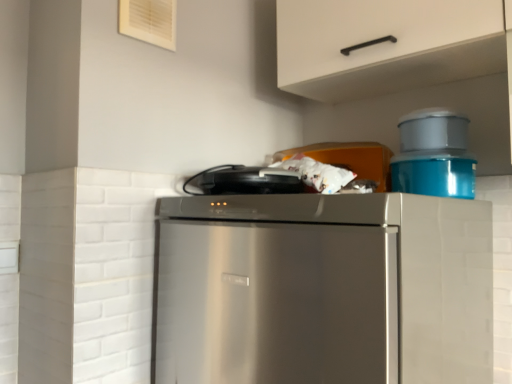
Locate an element on the screen. black matte toaster at upper center, the 3th appliance when ordered from right to left is located at coordinates (245, 181).

Based on the photo, measure the distance between point (457, 161) and camera.

The distance of point (457, 161) from camera is 1.02 meters.

Locate an element on the screen. The width and height of the screenshot is (512, 384). matte plastic container at upper right, placed as the 2th appliance when sorted from left to right is located at coordinates pyautogui.click(x=433, y=130).

At what (x,y) coordinates should I click in order to perform the action: click on black matte toaster at upper center, acting as the first appliance starting from the left. Please return your answer as a coordinate pair (x, y). This screenshot has width=512, height=384. Looking at the image, I should click on (245, 181).

Can you tell me how much blue plastic container at upper right, the third appliance from the left, and black matte toaster at upper center, acting as the first appliance starting from the left, differ in facing direction?

There is a 4.19e-05-degree angle between the facing directions of blue plastic container at upper right, the third appliance from the left, and black matte toaster at upper center, acting as the first appliance starting from the left.

At what (x,y) coordinates should I click in order to perform the action: click on the 2nd appliance behind the black matte toaster at upper center, the 3th appliance when ordered from right to left, starting your count from the anchor. Please return your answer as a coordinate pair (x, y). The image size is (512, 384). Looking at the image, I should click on (435, 177).

Between point (440, 186) and point (256, 167), which one is positioned behind?

Positioned behind is point (256, 167).

In the image, is blue plastic container at upper right, the third appliance from the left, positioned in front of or behind black matte toaster at upper center, the 3th appliance when ordered from right to left?

Clearly, blue plastic container at upper right, the third appliance from the left, is behind black matte toaster at upper center, the 3th appliance when ordered from right to left.

Measure the distance between stainless steel refrigerator at center and white matte cabinet handle at upper center.

stainless steel refrigerator at center is 21.94 inches away from white matte cabinet handle at upper center.

Would you say stainless steel refrigerator at center is to the left or to the right of white matte cabinet handle at upper center in the picture?

In the image, stainless steel refrigerator at center appears on the left side of white matte cabinet handle at upper center.

Is stainless steel refrigerator at center aimed at white matte cabinet handle at upper center?

No, stainless steel refrigerator at center is not facing towards white matte cabinet handle at upper center.

In terms of height, does stainless steel refrigerator at center look taller or shorter compared to white matte cabinet handle at upper center?

stainless steel refrigerator at center is taller than white matte cabinet handle at upper center.

Is blue plastic container at upper right, the third appliance from the left, wider than stainless steel refrigerator at center?

In fact, blue plastic container at upper right, the third appliance from the left, might be narrower than stainless steel refrigerator at center.

Is blue plastic container at upper right, the first appliance from the right, closer to camera compared to stainless steel refrigerator at center?

That is False.

From a real-world perspective, is blue plastic container at upper right, the first appliance from the right, located beneath stainless steel refrigerator at center?

No, from a real-world perspective, blue plastic container at upper right, the first appliance from the right, is not under stainless steel refrigerator at center.

Is matte plastic container at upper right, which appears as the second appliance when viewed from the right, touching white matte cabinet handle at upper center?

No, matte plastic container at upper right, which appears as the second appliance when viewed from the right, is not beside white matte cabinet handle at upper center.

From the image's perspective, is matte plastic container at upper right, which appears as the second appliance when viewed from the right, over white matte cabinet handle at upper center?

Incorrect, from the image's perspective, matte plastic container at upper right, which appears as the second appliance when viewed from the right, is lower than white matte cabinet handle at upper center.

Considering the relative sizes of matte plastic container at upper right, which appears as the second appliance when viewed from the right, and white matte cabinet handle at upper center in the image provided, is matte plastic container at upper right, which appears as the second appliance when viewed from the right, wider than white matte cabinet handle at upper center?

In fact, matte plastic container at upper right, which appears as the second appliance when viewed from the right, might be narrower than white matte cabinet handle at upper center.

Can you see stainless steel refrigerator at center touching matte plastic container at upper right, which appears as the second appliance when viewed from the right?

No, stainless steel refrigerator at center is not next to matte plastic container at upper right, which appears as the second appliance when viewed from the right.

Between stainless steel refrigerator at center and matte plastic container at upper right, which appears as the second appliance when viewed from the right, which one has more height?

stainless steel refrigerator at center.

Can you confirm if stainless steel refrigerator at center is positioned to the left of matte plastic container at upper right, placed as the 2th appliance when sorted from left to right?

Correct, you'll find stainless steel refrigerator at center to the left of matte plastic container at upper right, placed as the 2th appliance when sorted from left to right.

Based on the photo, from a real-world perspective, who is located lower, stainless steel refrigerator at center or matte plastic container at upper right, which appears as the second appliance when viewed from the right?

From a 3D spatial view, stainless steel refrigerator at center is below.

Which is in front, white matte cabinet handle at upper center or matte plastic container at upper right, placed as the 2th appliance when sorted from left to right?

white matte cabinet handle at upper center is closer to the camera.

Is matte plastic container at upper right, placed as the 2th appliance when sorted from left to right, at the back of white matte cabinet handle at upper center?

white matte cabinet handle at upper center is not turned away from matte plastic container at upper right, placed as the 2th appliance when sorted from left to right.

From a real-world perspective, between white matte cabinet handle at upper center and matte plastic container at upper right, which appears as the second appliance when viewed from the right, who is vertically higher?

white matte cabinet handle at upper center is physically above.

Which object is thinner, white matte cabinet handle at upper center or matte plastic container at upper right, placed as the 2th appliance when sorted from left to right?

matte plastic container at upper right, placed as the 2th appliance when sorted from left to right.

Is the position of stainless steel refrigerator at center more distant than that of blue plastic container at upper right, the third appliance from the left?

No.

Which is behind, point (256, 233) or point (448, 159)?

Point (448, 159)

Is stainless steel refrigerator at center facing away from blue plastic container at upper right, the first appliance from the right?

No, stainless steel refrigerator at center is not facing the opposite direction of blue plastic container at upper right, the first appliance from the right.

Where is `the 2nd appliance counting from the right side of the black matte toaster at upper center, acting as the first appliance starting from the left`? the 2nd appliance counting from the right side of the black matte toaster at upper center, acting as the first appliance starting from the left is located at coordinates (435, 177).

Locate an element on the screen. This screenshot has width=512, height=384. home appliance in front of the white matte cabinet handle at upper center is located at coordinates (324, 289).

Looking at the image, which one is located closer to white matte cabinet handle at upper center, blue plastic container at upper right, the third appliance from the left, or black matte toaster at upper center, the 3th appliance when ordered from right to left?

blue plastic container at upper right, the third appliance from the left, is positioned closer to the anchor white matte cabinet handle at upper center.

Based on their spatial positions, is stainless steel refrigerator at center or matte plastic container at upper right, which appears as the second appliance when viewed from the right, closer to black matte toaster at upper center, acting as the first appliance starting from the left?

stainless steel refrigerator at center lies closer to black matte toaster at upper center, acting as the first appliance starting from the left, than the other object.

Considering their positions, is black matte toaster at upper center, the 3th appliance when ordered from right to left, positioned further to matte plastic container at upper right, placed as the 2th appliance when sorted from left to right, than stainless steel refrigerator at center?

The object further to matte plastic container at upper right, placed as the 2th appliance when sorted from left to right, is stainless steel refrigerator at center.

Based on their spatial positions, is stainless steel refrigerator at center or matte plastic container at upper right, placed as the 2th appliance when sorted from left to right, further from white matte cabinet handle at upper center?

stainless steel refrigerator at center.

Considering their positions, is matte plastic container at upper right, which appears as the second appliance when viewed from the right, positioned further to white matte cabinet handle at upper center than stainless steel refrigerator at center?

The object further to white matte cabinet handle at upper center is stainless steel refrigerator at center.

Looking at the image, which one is located closer to stainless steel refrigerator at center, blue plastic container at upper right, the first appliance from the right, or matte plastic container at upper right, placed as the 2th appliance when sorted from left to right?

blue plastic container at upper right, the first appliance from the right.

Based on their spatial positions, is matte plastic container at upper right, placed as the 2th appliance when sorted from left to right, or blue plastic container at upper right, the third appliance from the left, closer to stainless steel refrigerator at center?

The object closer to stainless steel refrigerator at center is blue plastic container at upper right, the third appliance from the left.

When comparing their distances from black matte toaster at upper center, acting as the first appliance starting from the left, does matte plastic container at upper right, which appears as the second appliance when viewed from the right, or stainless steel refrigerator at center seem further?

The object further to black matte toaster at upper center, acting as the first appliance starting from the left, is matte plastic container at upper right, which appears as the second appliance when viewed from the right.

Identify the location of appliance between white matte cabinet handle at upper center and blue plastic container at upper right, the third appliance from the left, in the up-down direction. [433, 130].

You are a GUI agent. You are given a task and a screenshot of the screen. Output one action in this format:
    pyautogui.click(x=<x>, y=<y>)
    Task: Click on the appliance situated between black matte toaster at upper center, the 3th appliance when ordered from right to left, and blue plastic container at upper right, the first appliance from the right, from left to right
    The height and width of the screenshot is (384, 512).
    Given the screenshot: What is the action you would take?
    pyautogui.click(x=433, y=130)

You are a GUI agent. You are given a task and a screenshot of the screen. Output one action in this format:
    pyautogui.click(x=<x>, y=<y>)
    Task: Click on the cabinetry located between black matte toaster at upper center, the 3th appliance when ordered from right to left, and blue plastic container at upper right, the third appliance from the left, in the left-right direction
    Image resolution: width=512 pixels, height=384 pixels.
    Given the screenshot: What is the action you would take?
    pyautogui.click(x=385, y=45)

You are a GUI agent. You are given a task and a screenshot of the screen. Output one action in this format:
    pyautogui.click(x=<x>, y=<y>)
    Task: Click on the home appliance situated between black matte toaster at upper center, acting as the first appliance starting from the left, and blue plastic container at upper right, the first appliance from the right, from left to right
    This screenshot has height=384, width=512.
    Given the screenshot: What is the action you would take?
    pyautogui.click(x=324, y=289)